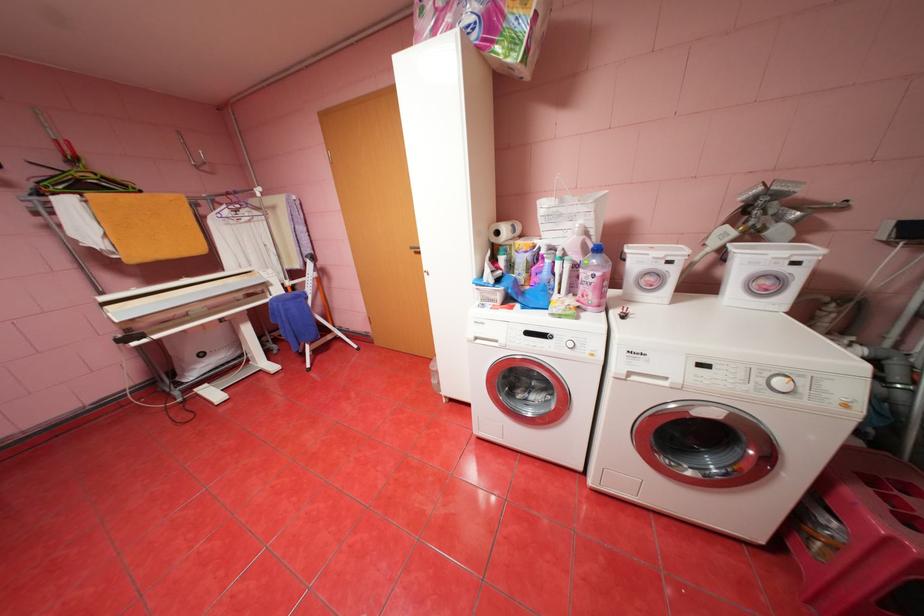
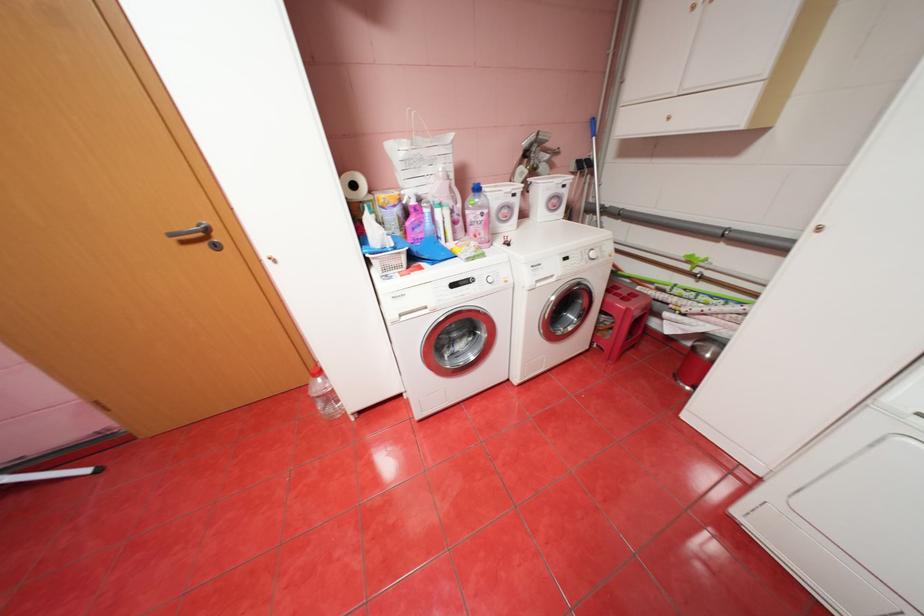
Where in the second image is the point corresponding to point (789, 278) from the first image?

(566, 197)